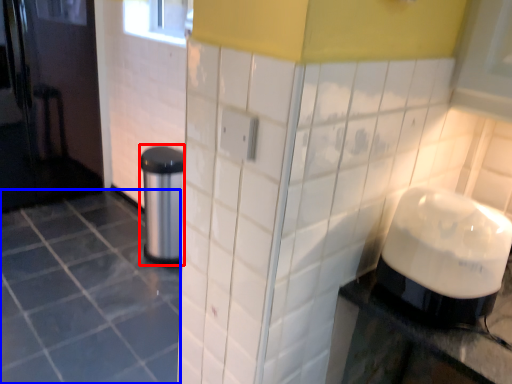
Question: Which object appears closest to the camera in this image, appliance (highlighted by a red box) or ceramic tile (highlighted by a blue box)?

Choices:
 (A) appliance
 (B) ceramic tile

Answer: (B)